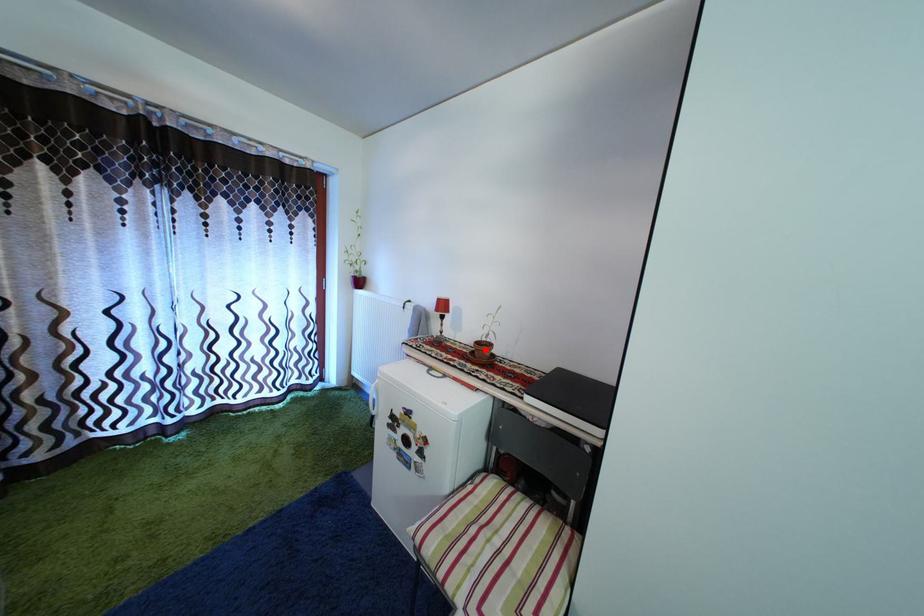
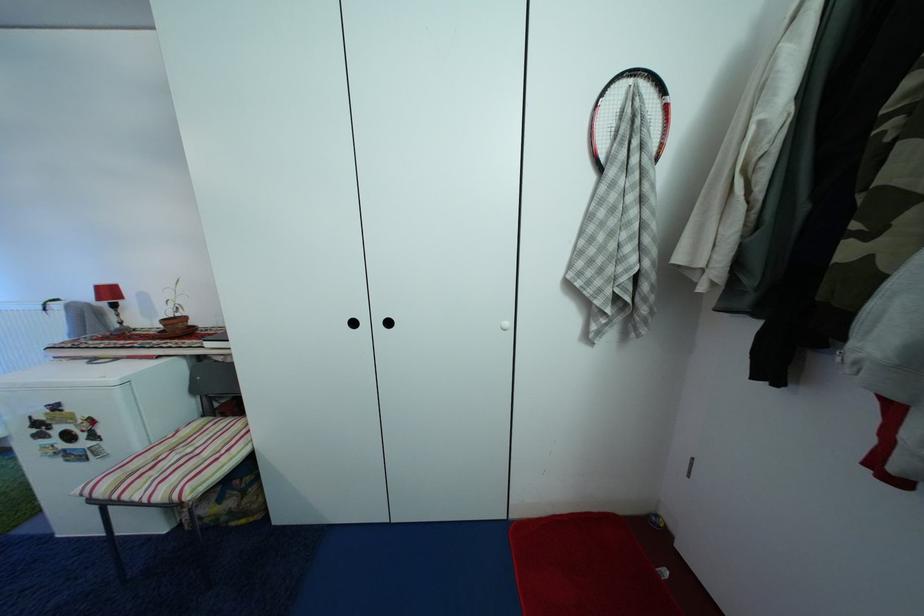
Find the pixel in the second image that matches the highlighted location in the first image.

(174, 326)